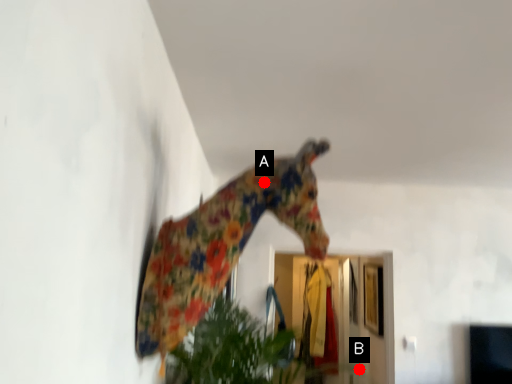
Question: Two points are circled on the image, labeled by A and B beside each circle. Which point is closer to the camera?

Choices:
 (A) A is closer
 (B) B is closer

Answer: (A)